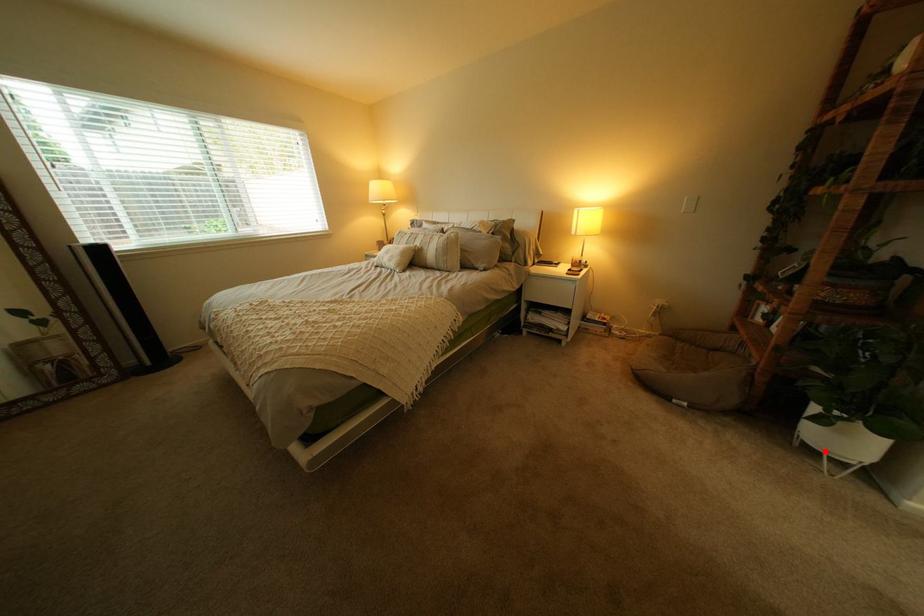
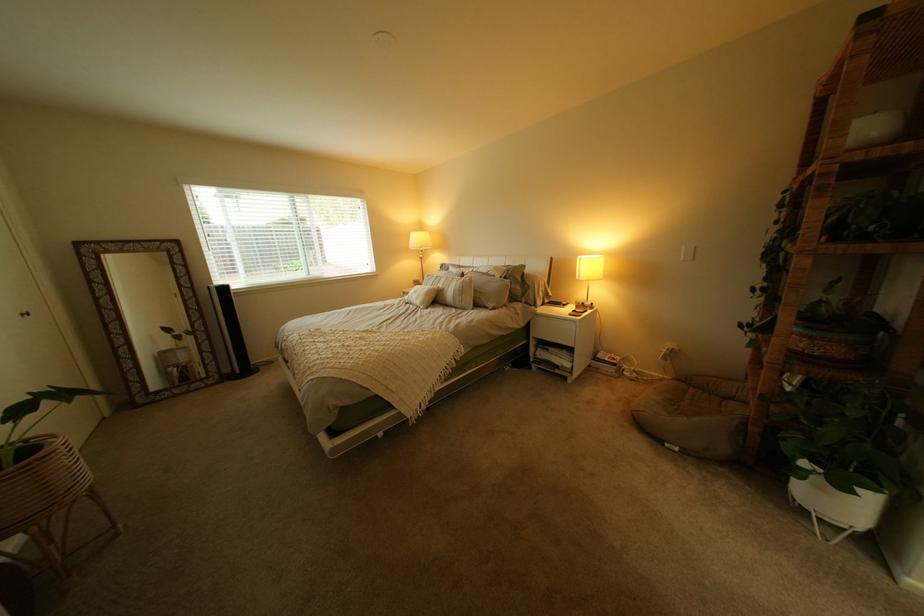
In the second image, find the point that corresponds to the highlighted location in the first image.

(821, 512)